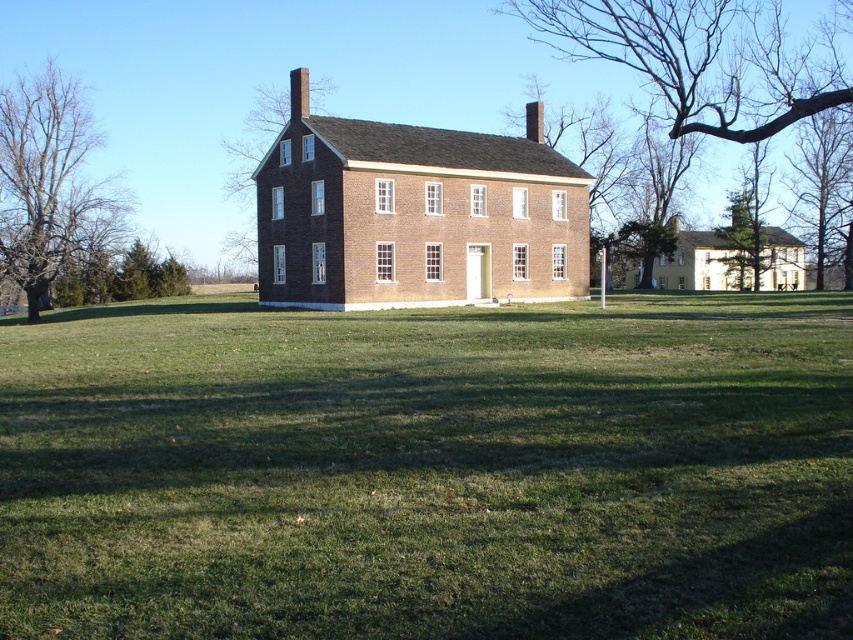
Between green grass at center and bare branches at upper center, which one has more height?

Standing taller between the two is bare branches at upper center.

From the picture: Can you confirm if green grass at center is positioned to the left of bare branches at upper center?

Indeed, green grass at center is positioned on the left side of bare branches at upper center.

This screenshot has width=853, height=640. What do you see at coordinates (428, 470) in the screenshot? I see `green grass at center` at bounding box center [428, 470].

Locate an element on the screen. green grass at center is located at coordinates (428, 470).

Who is more distant from viewer, (x=811, y=170) or (x=323, y=84)?

Positioned behind is point (x=323, y=84).

This screenshot has width=853, height=640. What do you see at coordinates (824, 189) in the screenshot?
I see `bare branches at upper right` at bounding box center [824, 189].

Who is more forward, (x=849, y=112) or (x=245, y=246)?

Positioned in front is point (x=849, y=112).

Locate an element on the screen. bare branches at upper right is located at coordinates (824, 189).

Can you confirm if bare branches at upper center is smaller than bare branches at upper right?

Incorrect, bare branches at upper center is not smaller in size than bare branches at upper right.

Which is in front, point (834, 99) or point (817, 180)?

Point (834, 99) is in front.

Who is more distant from viewer, (769, 72) or (822, 124)?

Point (769, 72)

Find the location of `bare branches at upper center`. bare branches at upper center is located at coordinates (701, 60).